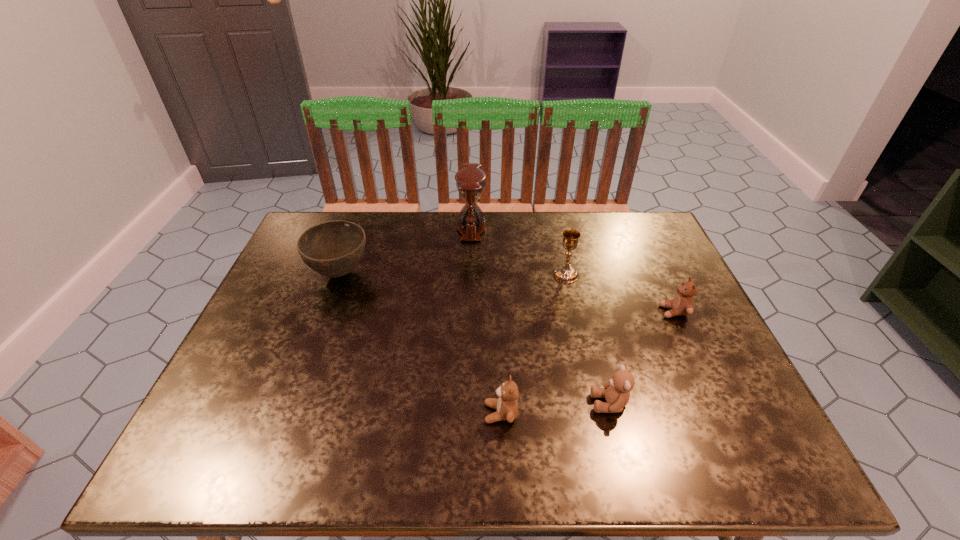
The image size is (960, 540). Find the location of `blank space located 0.070m on the left of the leftmost object`. blank space located 0.070m on the left of the leftmost object is located at coordinates (284, 273).

This screenshot has height=540, width=960. In order to click on vacant position located on the front-facing side of the third nearest object in this screenshot , I will do `click(509, 312)`.

Identify the location of free region located on the front-facing side of the third nearest object. (571, 312).

What are the coordinates of `free space located on the front-facing side of the third nearest object` in the screenshot? It's located at (606, 312).

The width and height of the screenshot is (960, 540). In order to click on vacant space located on the front-facing side of the leftmost teddy bear in this screenshot , I will do (412, 413).

Locate an element on the screen. The image size is (960, 540). vacant space located 0.190m on the front-facing side of the leftmost teddy bear is located at coordinates (393, 413).

Locate an element on the screen. vacant position located on the front-facing side of the leftmost teddy bear is located at coordinates (455, 413).

The height and width of the screenshot is (540, 960). I want to click on free space located 0.390m on the face of the second teddy bear from left to right, so click(x=406, y=403).

What are the coordinates of `free region located on the face of the second teddy bear from left to right` in the screenshot? It's located at (516, 403).

Where is `free point located 0.280m on the face of the second teddy bear from left to right`? The width and height of the screenshot is (960, 540). free point located 0.280m on the face of the second teddy bear from left to right is located at coordinates (458, 403).